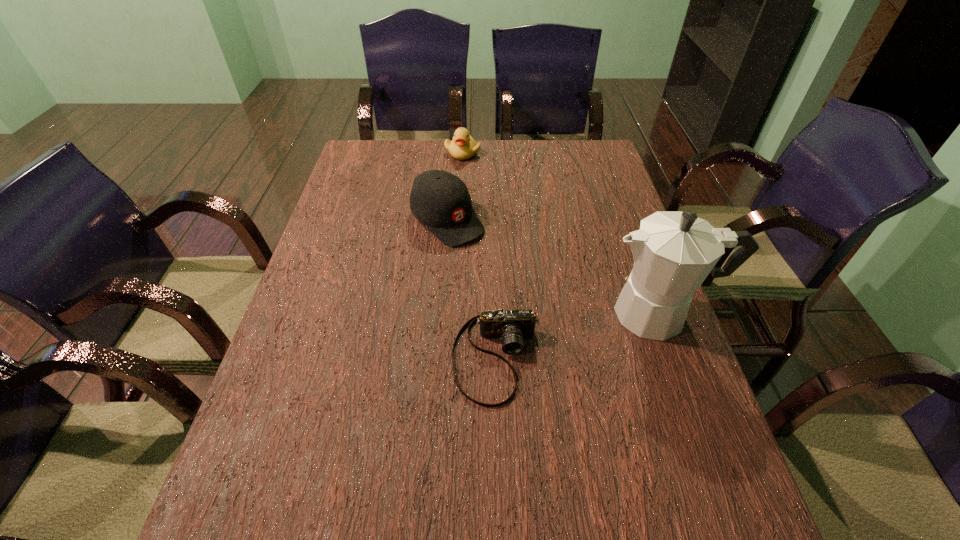
At what (x,y) coordinates should I click in order to perform the action: click on vacant space situated at the spout of the tallest object. Please return your answer as a coordinate pair (x, y). Image resolution: width=960 pixels, height=540 pixels. Looking at the image, I should click on [548, 313].

I want to click on vacant space located on the beak of the third tallest object, so click(500, 215).

In order to click on vacant space situated on the beak of the third tallest object in this screenshot , I will do `click(492, 202)`.

At what (x,y) coordinates should I click in order to perform the action: click on vacant space located on the beak of the third tallest object. Please return your answer as a coordinate pair (x, y). Image resolution: width=960 pixels, height=540 pixels. Looking at the image, I should click on (479, 180).

This screenshot has height=540, width=960. What are the coordinates of `free space located with a logo on the front of the second farthest object` in the screenshot? It's located at (511, 282).

Locate an element on the screen. free spot located 0.050m with a logo on the front of the second farthest object is located at coordinates (479, 252).

The width and height of the screenshot is (960, 540). Identify the location of vacant area situated 0.170m with a logo on the front of the second farthest object. (506, 277).

The width and height of the screenshot is (960, 540). What are the coordinates of `object that is at the far edge` in the screenshot? It's located at (463, 146).

At what (x,y) coordinates should I click in order to perform the action: click on object located in the right edge section of the desktop. Please return your answer as a coordinate pair (x, y). The width and height of the screenshot is (960, 540). Looking at the image, I should click on (674, 251).

Image resolution: width=960 pixels, height=540 pixels. In the image, there is a desktop. What are the coordinates of `vacant space at the far edge` in the screenshot? It's located at (400, 163).